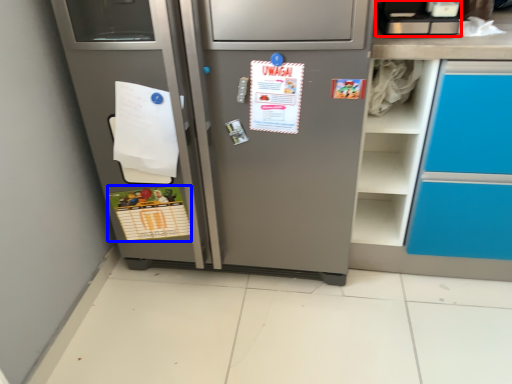
Question: Which point is further to the camera, appliance (highlighted by a red box) or postcard (highlighted by a blue box)?

Choices:
 (A) appliance
 (B) postcard

Answer: (B)